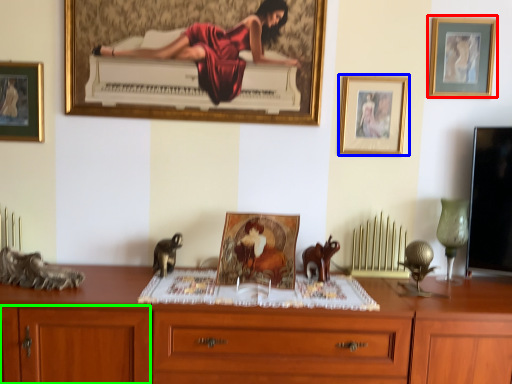
Question: Based on their relative distances, which object is farther from picture frame (highlighted by a red box)? Choose from picture frame (highlighted by a blue box) and cabinetry (highlighted by a green box).

Choices:
 (A) picture frame
 (B) cabinetry

Answer: (B)